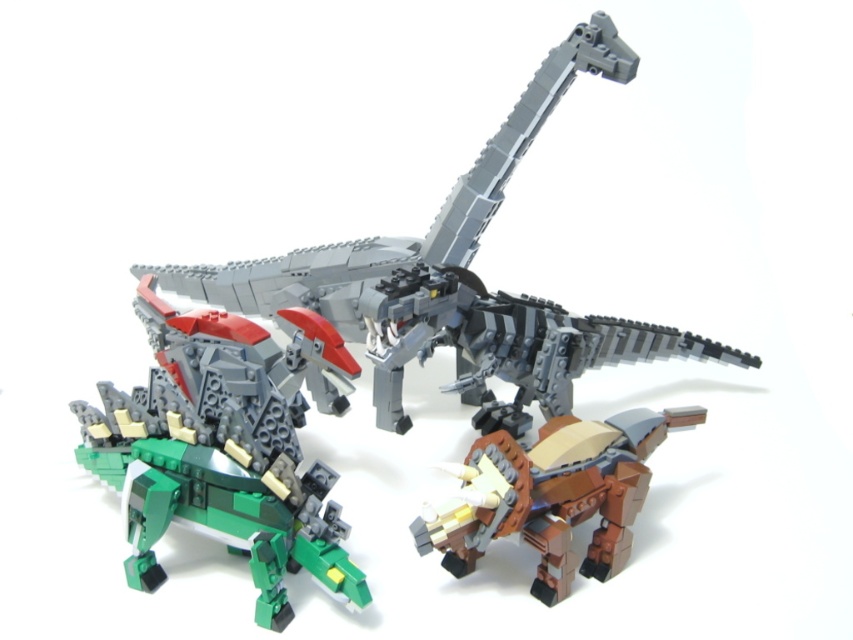
You are standing in front of the LEGO dinosaur models. There are two points marked on the image at coordinates point [201,317] and point [627,440]. Which point is closer to you?

Point [201,317] is closer to you as it is further to the viewer than point [627,440].